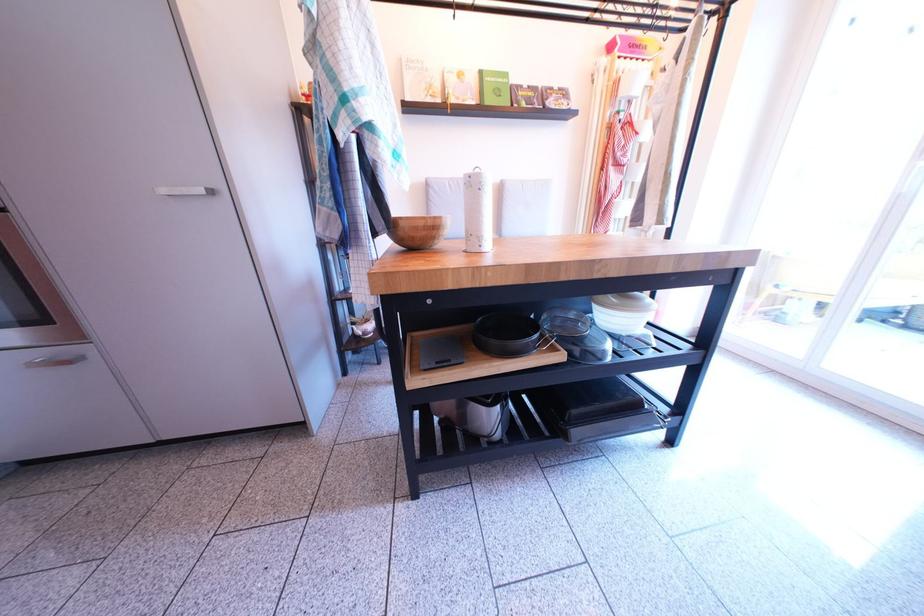
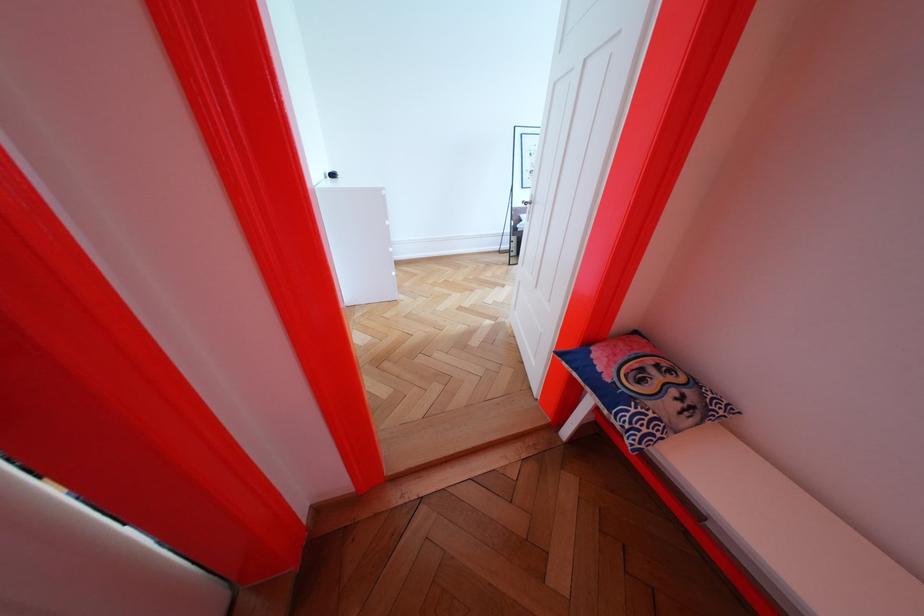
Question: What movement of the cameraman would produce the second image?

Choices:
 (A) Left
 (B) Right
 (C) Forward
 (D) Backward

Answer: (A)